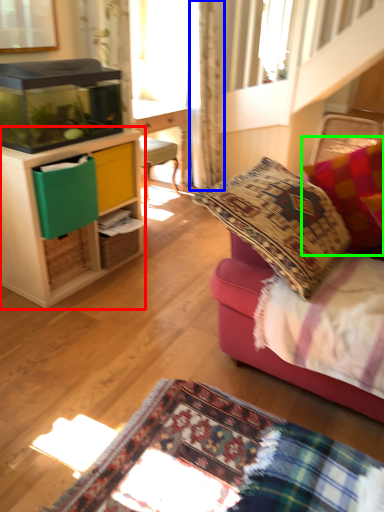
Question: Considering the real-world distances, which object is farthest from cabinetry (highlighted by a red box)? curtain (highlighted by a blue box) or pillow (highlighted by a green box)?

Choices:
 (A) curtain
 (B) pillow

Answer: (A)